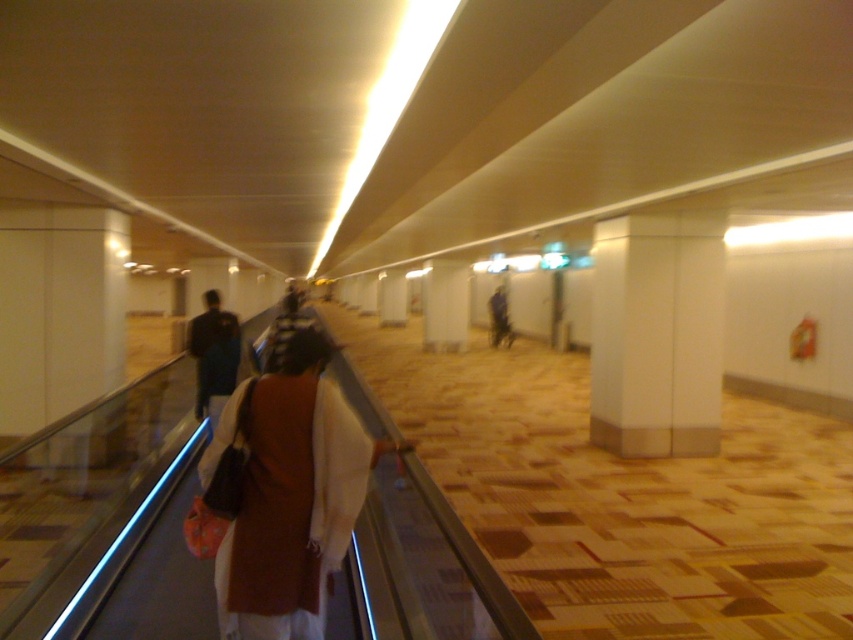
Question: Among these objects, which one is nearest to the camera?

Choices:
 (A) brown fabric bag at center
 (B) dark blue jacket at center

Answer: (A)

Question: Is the position of dark blue jacket at left more distant than that of dark blue jacket at center?

Choices:
 (A) yes
 (B) no

Answer: (B)

Question: Does brown fabric bag at center appear on the left side of dark blue jacket at center?

Choices:
 (A) yes
 (B) no

Answer: (A)

Question: From the image, what is the correct spatial relationship of dark blue jacket at left in relation to dark blue jacket at center?

Choices:
 (A) left
 (B) right

Answer: (A)

Question: Which object is farther from the camera taking this photo?

Choices:
 (A) dark blue jacket at center
 (B) dark blue jacket at left

Answer: (A)

Question: Which object is positioned closest to the brown fabric bag at center?

Choices:
 (A) dark blue jacket at left
 (B) dark blue jacket at center

Answer: (A)